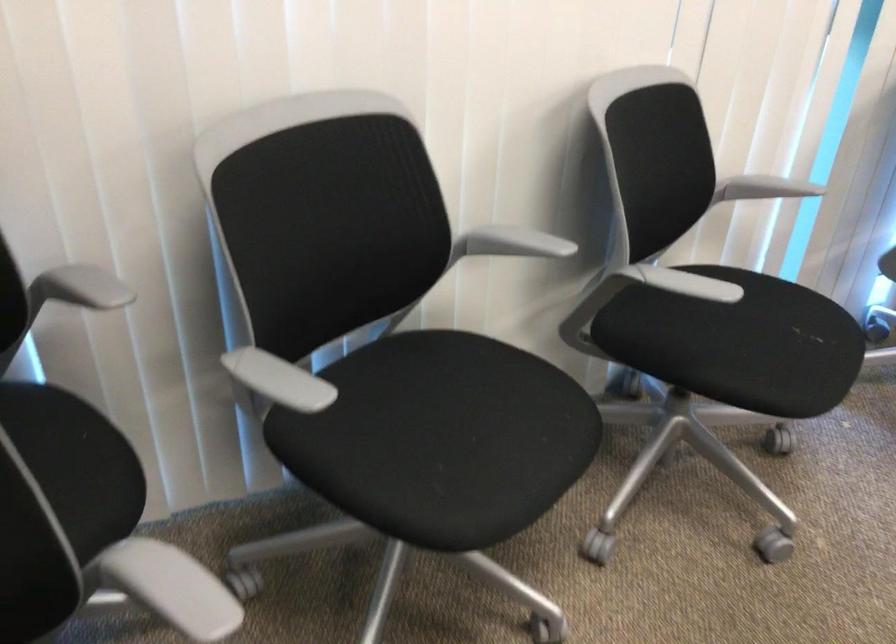
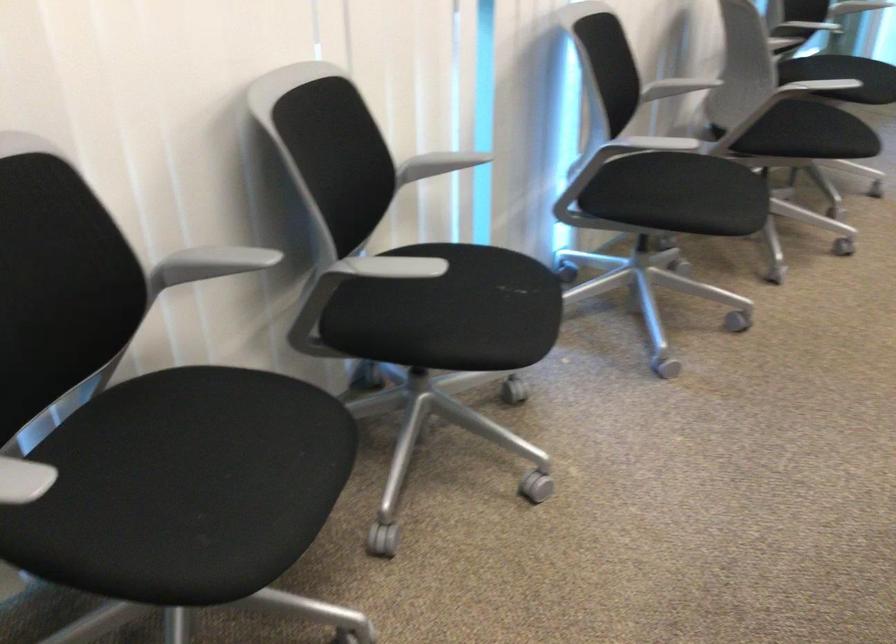
Locate, in the second image, the point that corresponds to point 812,335 in the first image.

(515, 287)